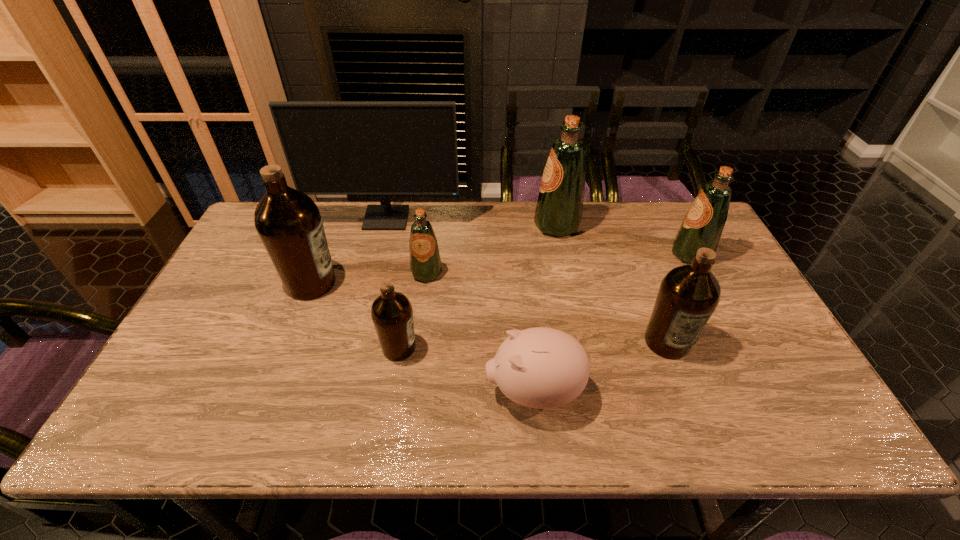
You are a GUI agent. You are given a task and a screenshot of the screen. Output one action in this format:
    pyautogui.click(x=<x>, y=<y>)
    Task: Click on the brown olive oil that is the second nearest to the second biggest brown olive oil
    
    Given the screenshot: What is the action you would take?
    pyautogui.click(x=288, y=222)

Image resolution: width=960 pixels, height=540 pixels. What are the coordinates of `blank area in the image that satisfies the following two spatial constraints: 1. on the front-facing side of the leftmost green olive oil; 2. on the label of the leftmost olive oil` in the screenshot? It's located at (425, 284).

Where is `vacant position in the image that satisfies the following two spatial constraints: 1. on the front-facing side of the smallest green olive oil; 2. on the label of the smallest brown olive oil`? This screenshot has height=540, width=960. vacant position in the image that satisfies the following two spatial constraints: 1. on the front-facing side of the smallest green olive oil; 2. on the label of the smallest brown olive oil is located at coordinates (418, 348).

Locate an element on the screen. free space that satisfies the following two spatial constraints: 1. on the front-facing side of the leftmost green olive oil; 2. on the label of the farthest brown olive oil is located at coordinates (425, 284).

This screenshot has height=540, width=960. I want to click on free space in the image that satisfies the following two spatial constraints: 1. on the label of the second biggest brown olive oil; 2. on the label of the second brown olive oil from right to left, so click(x=669, y=348).